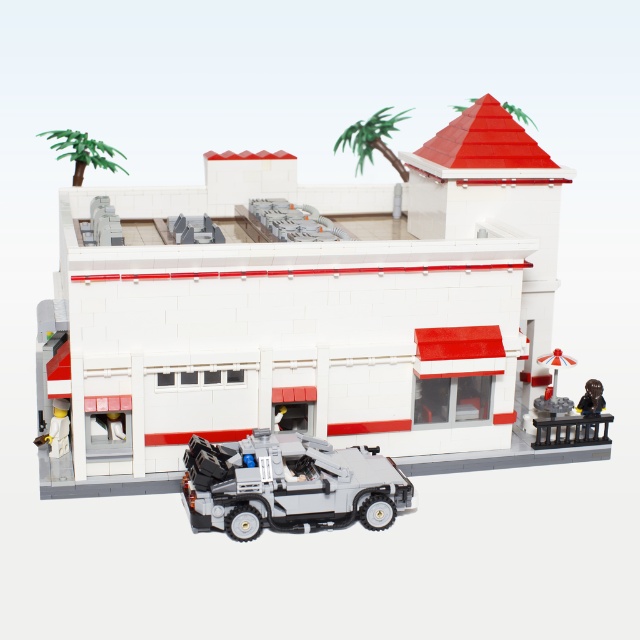
Measure the distance between gray plastic car at lower center and green plastic palm tree at upper left.

gray plastic car at lower center is 9.26 feet away from green plastic palm tree at upper left.

From the picture: How far apart are gray plastic car at lower center and green plastic palm tree at upper left?

2.82 meters

Which is in front, point (195, 451) or point (93, 141)?

Positioned in front is point (195, 451).

Image resolution: width=640 pixels, height=640 pixels. I want to click on gray plastic car at lower center, so click(x=289, y=484).

You are a GUI agent. You are given a task and a screenshot of the screen. Output one action in this format:
    pyautogui.click(x=<x>, y=<y>)
    Task: Click on the gray plastic car at lower center
    
    Given the screenshot: What is the action you would take?
    pyautogui.click(x=289, y=484)

Is white matte building at center above green plastic palm tree at upper left?

No.

Who is positioned more to the right, white matte building at center or green plastic palm tree at upper left?

From the viewer's perspective, white matte building at center appears more on the right side.

You are a GUI agent. You are given a task and a screenshot of the screen. Output one action in this format:
    pyautogui.click(x=<x>, y=<y>)
    Task: Click on the white matte building at center
    The image size is (640, 640).
    Given the screenshot: What is the action you would take?
    pyautogui.click(x=307, y=310)